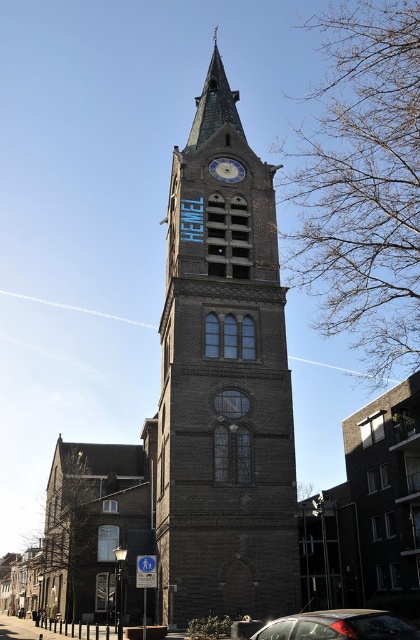
Question: In this image, where is metallic gray car at lower right located relative to blue stone clock at center?

Choices:
 (A) above
 (B) below

Answer: (B)

Question: Which point is closer to the camera?

Choices:
 (A) coord(193,550)
 (B) coord(262,634)

Answer: (B)

Question: Does dark brown stone tower at center have a lesser width compared to blue stone clock at center?

Choices:
 (A) no
 (B) yes

Answer: (A)

Question: Does dark brown stone tower at center have a larger size compared to blue stone clock at center?

Choices:
 (A) yes
 (B) no

Answer: (A)

Question: Among these points, which one is farthest from the camera?

Choices:
 (A) (212, 500)
 (B) (383, 621)
 (C) (226, 182)

Answer: (C)

Question: Which object is farther from the camera taking this photo?

Choices:
 (A) dark brown stone tower at center
 (B) blue stone clock at center
 (C) metallic gray car at lower right

Answer: (B)